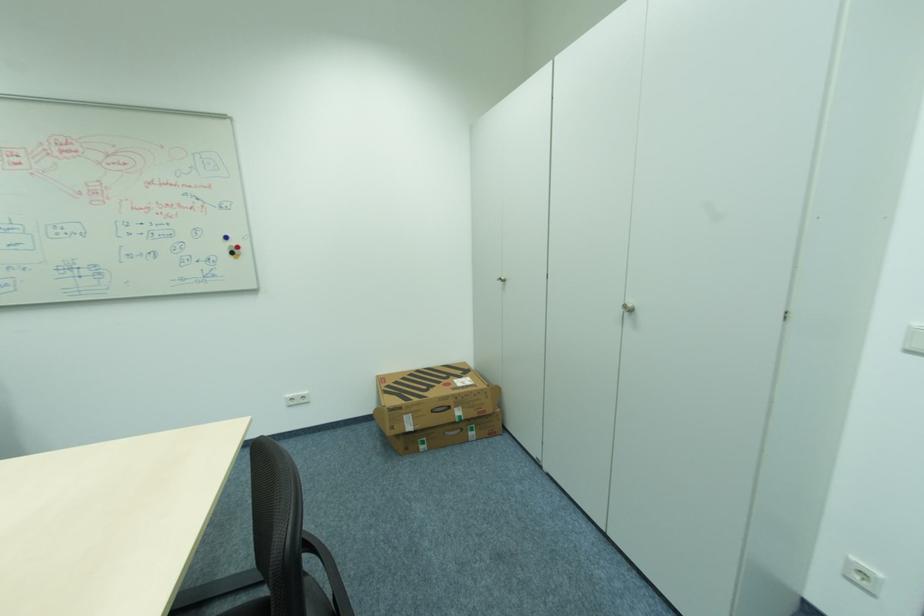
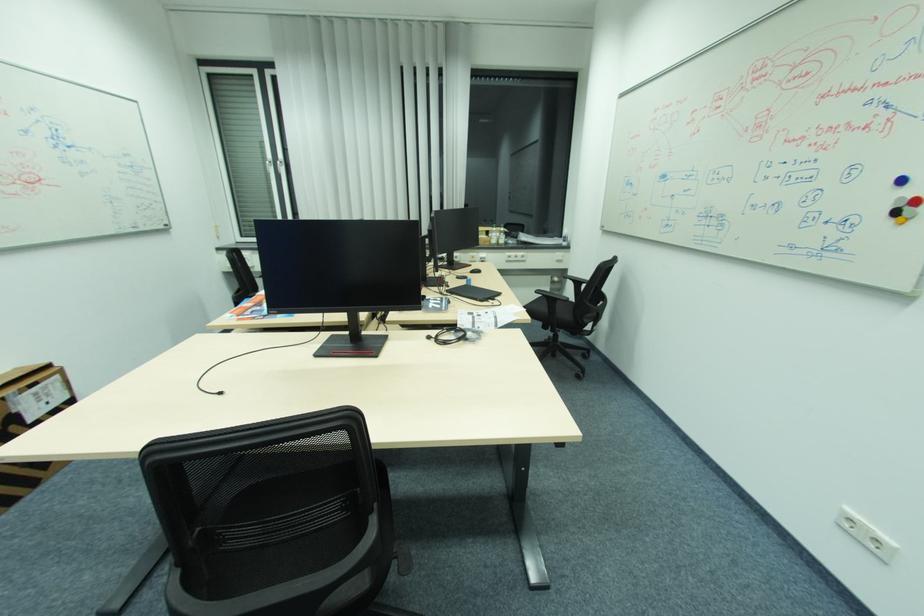
Where in the second image is the point corresponding to point 237,257 from the first image?

(896, 221)